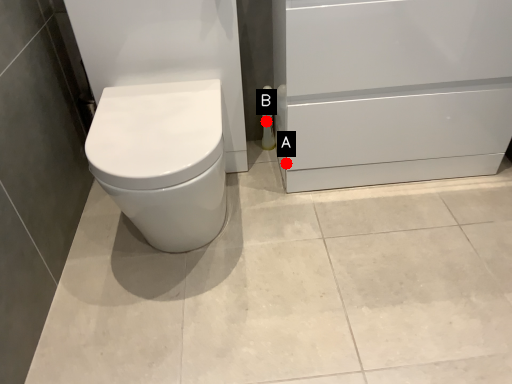
Question: Two points are circled on the image, labeled by A and B beside each circle. Among these points, which one is nearest to the camera?

Choices:
 (A) A is closer
 (B) B is closer

Answer: (A)